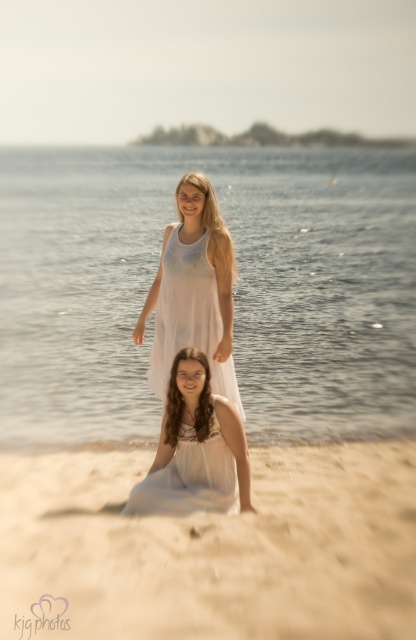
You are a photographer trying to capture both the white sheer dress at center and the white sheer dress at lower center in the same frame. Which dress is closer to the camera?

The white sheer dress at center is closer to the camera because the white sheer dress at lower center is behind it.

You are a photographer positioned at the edge of the beach. You want to capture a photo that includes both the clear water at center and the white sheer dress at lower center. Which object should you focus on first to ensure both are in sharp focus?

The clear water at center is further to the viewer than the white sheer dress at lower center, so you should focus on the clear water at center first to ensure both are in sharp focus.